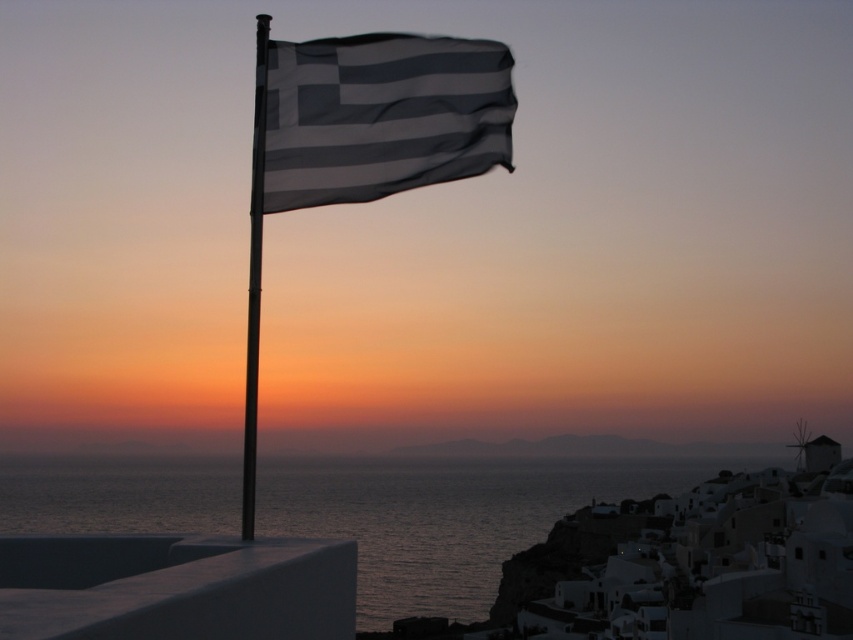
You are standing at the center of the image and want to look at both the transparent water at lower left and the metallic flag pole at upper left. Which object will you need to tilt your head upwards more to view?

The metallic flag pole at upper left requires tilting your head upwards more because it is positioned higher in the image than the transparent water at lower left, which has a greater height but is located lower down.

You are standing at the center of the image and want to walk towards the transparent water at lower left. Which direction should you move in?

Since the transparent water at lower left is located at point (444, 518), you should move towards the lower left direction to reach it.